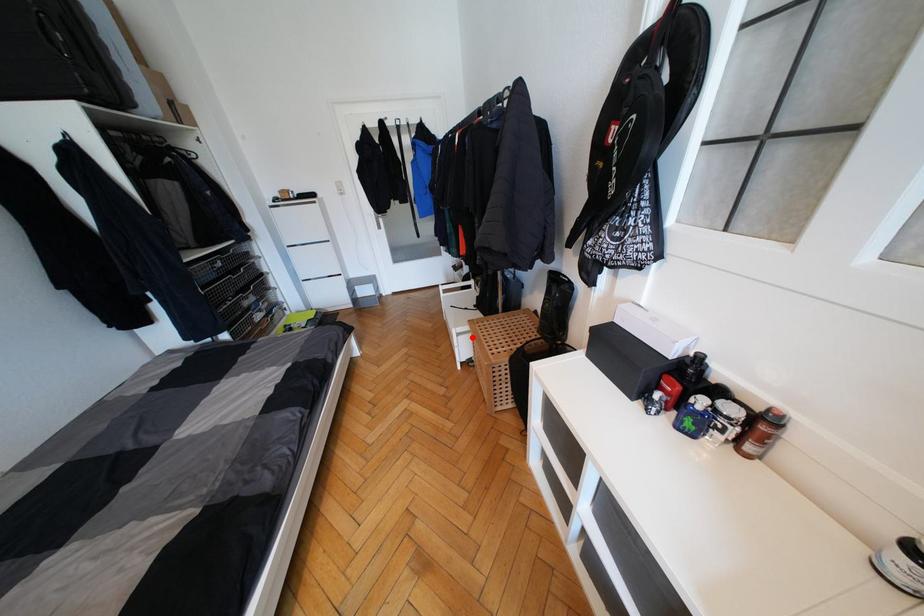
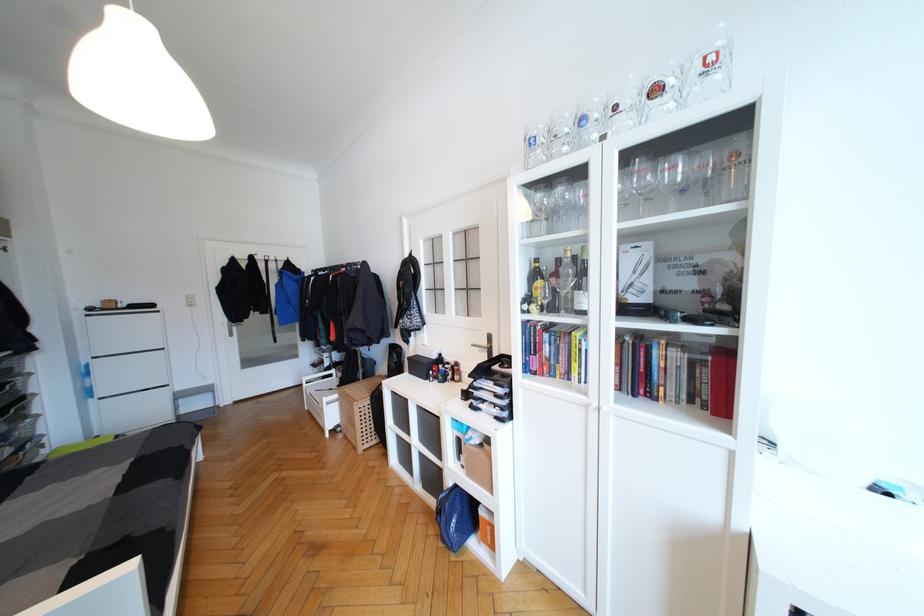
Where in the second image is the point corresponding to the highlighted location from the first image?

(339, 405)